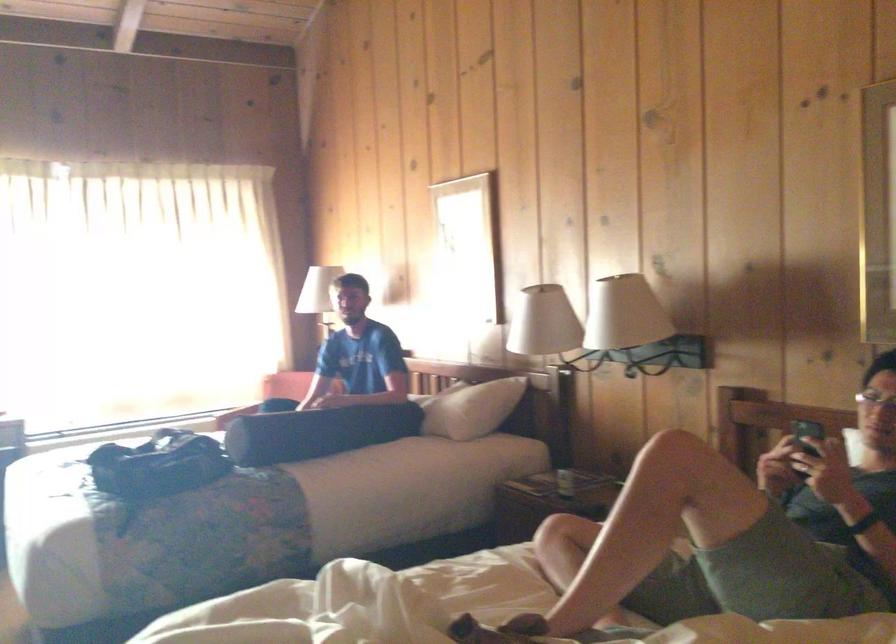
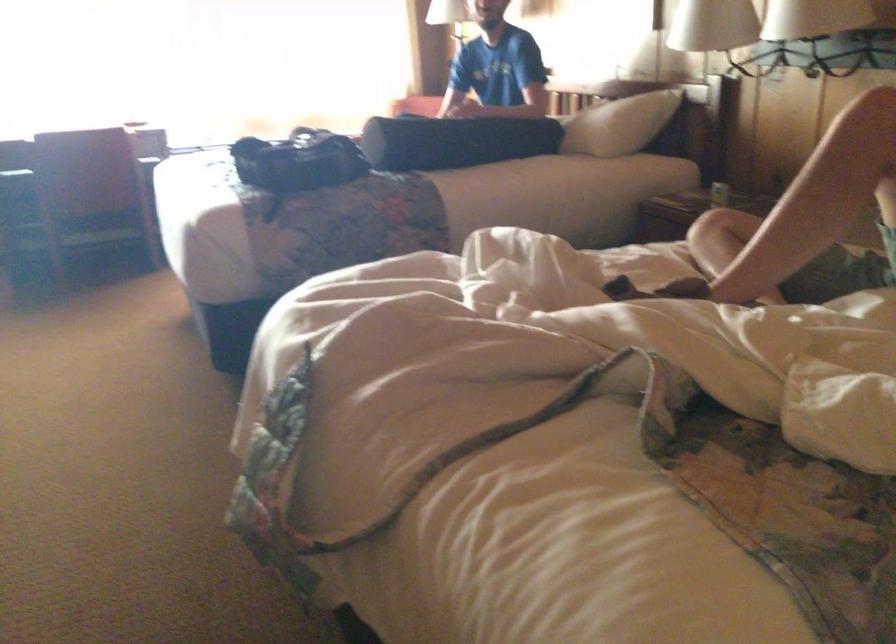
In the second image, find the point that corresponds to (321,436) in the first image.

(454, 140)